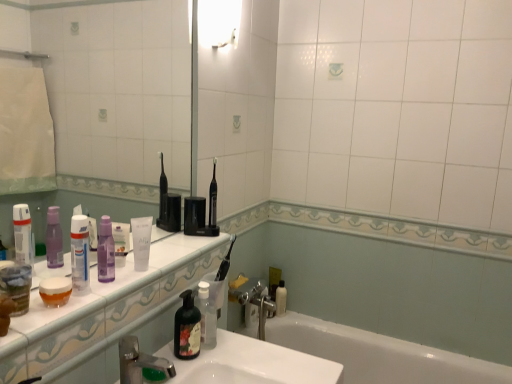
This screenshot has height=384, width=512. In order to click on free space in front of black plastic toothbrush at center in this screenshot , I will do `click(188, 248)`.